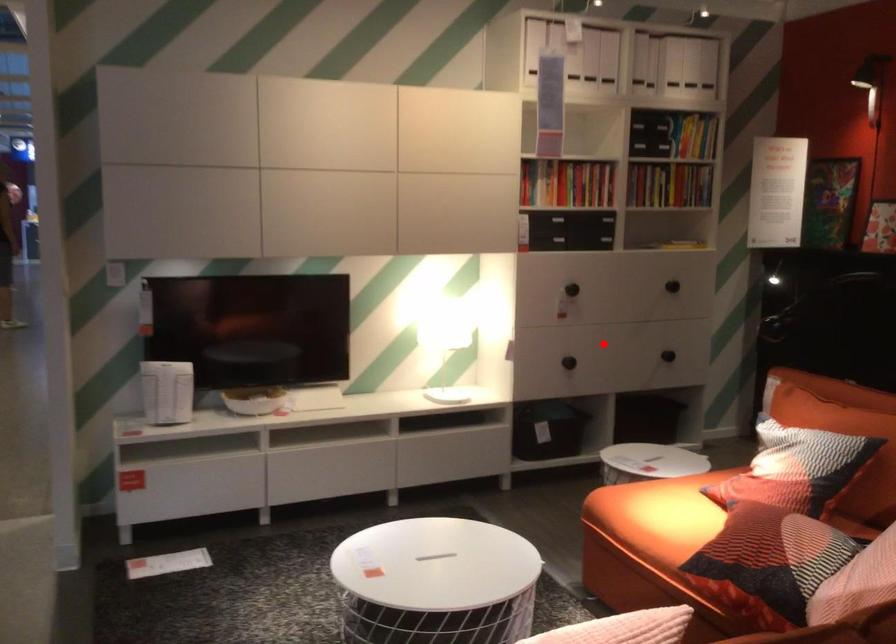
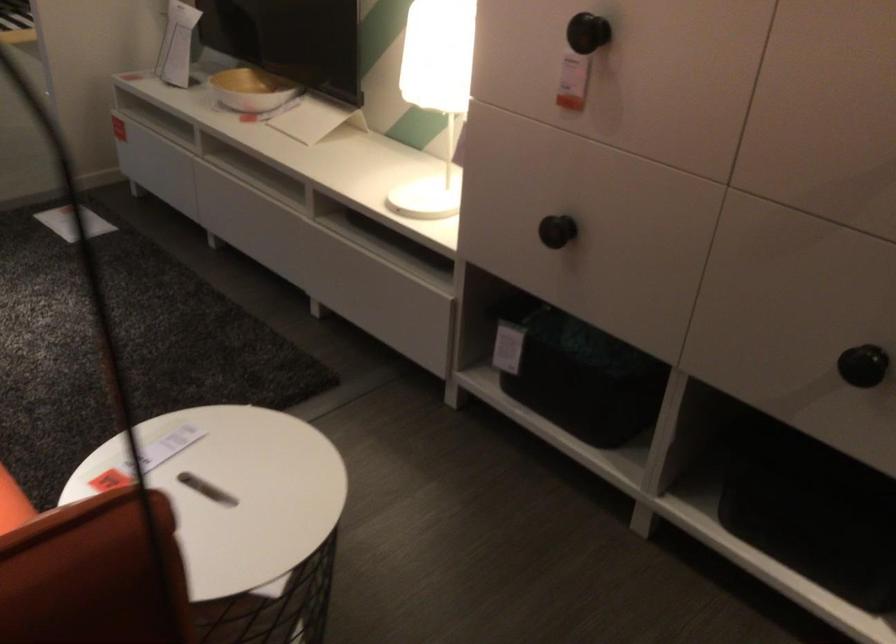
Question: I am providing you with two images of the same scene from different viewpoints. A red point is marked on the first image. Is the red point's position out of view in image 2?

Choices:
 (A) Yes
 (B) No

Answer: (B)